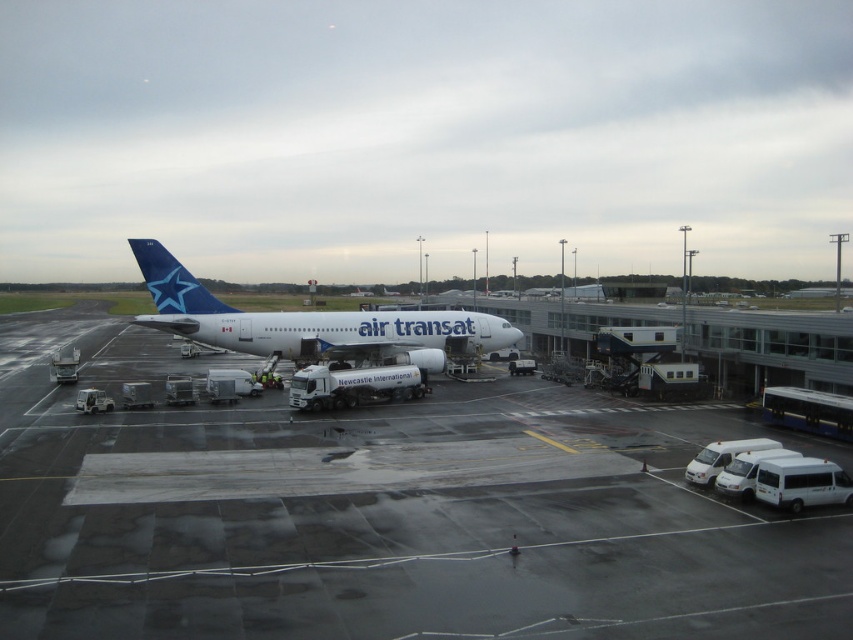
Can you confirm if smooth asphalt tarmac at center is smaller than white glossy airplane at center?

No.

Is point (476, 429) more distant than point (207, 332)?

No, (476, 429) is in front of (207, 332).

Describe the element at coordinates (395, 522) in the screenshot. I see `smooth asphalt tarmac at center` at that location.

This screenshot has height=640, width=853. In order to click on smooth asphalt tarmac at center in this screenshot , I will do `click(395, 522)`.